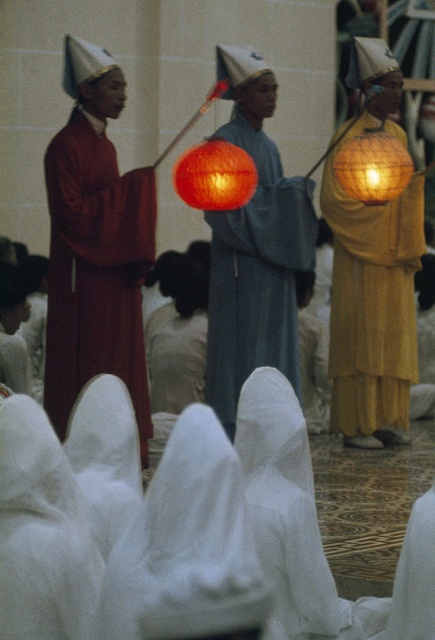
Question: Where is yellow matte robe at right located in relation to matte gray robe at center in the image?

Choices:
 (A) above
 (B) below

Answer: (B)

Question: Does yellow matte robe at right have a larger size compared to orange mesh lantern at center?

Choices:
 (A) no
 (B) yes

Answer: (B)

Question: Can you confirm if matte gray robe at center is thinner than bright orange paper lantern at center?

Choices:
 (A) yes
 (B) no

Answer: (B)

Question: Estimate the real-world distances between objects in this image. Which object is closer to the bright orange paper lantern at center?

Choices:
 (A) orange mesh lantern at center
 (B) matte gray robe at center
 (C) matte red robe at left

Answer: (B)

Question: Among these points, which one is nearest to the camera?

Choices:
 (A) (63, 410)
 (B) (378, 141)
 (C) (298, 230)

Answer: (A)

Question: Among these points, which one is nearest to the camera?

Choices:
 (A) (224, 260)
 (B) (123, 268)
 (C) (337, 260)

Answer: (B)